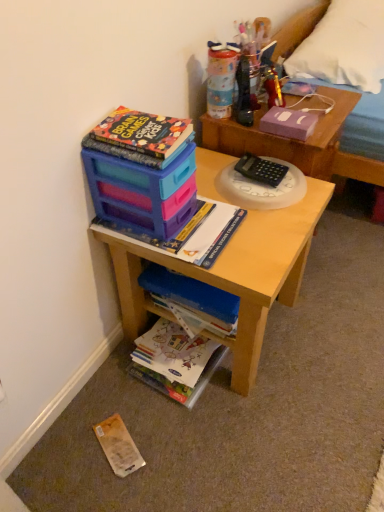
This screenshot has width=384, height=512. In order to click on empty space that is in between colored paper art at lower center, arranged as the 1th book when ordered from the bottom, and yellow paper at lower left, which is the 2th paperback book in top-to-bottom order in this screenshot , I will do `click(132, 412)`.